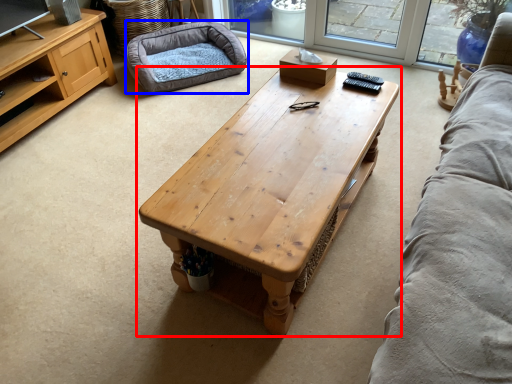
Question: Which point is closer to the camera, coffee table (highlighted by a red box) or dog bed (highlighted by a blue box)?

Choices:
 (A) coffee table
 (B) dog bed

Answer: (A)